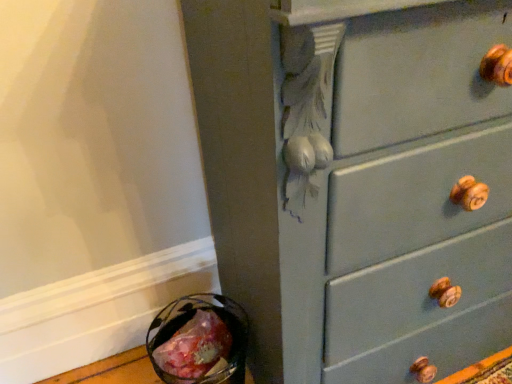
Question: Is matte gray dresser at center-right taller or shorter than translucent plastic bag at lower left?

Choices:
 (A) tall
 (B) short

Answer: (A)

Question: From a real-world perspective, is matte gray dresser at center-right physically located above or below translucent plastic bag at lower left?

Choices:
 (A) below
 (B) above

Answer: (B)

Question: Visually, is matte gray dresser at center-right positioned to the left or to the right of translucent plastic bag at lower left?

Choices:
 (A) right
 (B) left

Answer: (A)

Question: Based on their sizes in the image, would you say translucent plastic bag at lower left is bigger or smaller than matte gray dresser at center-right?

Choices:
 (A) big
 (B) small

Answer: (B)

Question: Is translucent plastic bag at lower left taller or shorter than matte gray dresser at center-right?

Choices:
 (A) tall
 (B) short

Answer: (B)

Question: Looking at their shapes, would you say translucent plastic bag at lower left is wider or thinner than matte gray dresser at center-right?

Choices:
 (A) thin
 (B) wide

Answer: (A)

Question: Do you think translucent plastic bag at lower left is within matte gray dresser at center-right, or outside of it?

Choices:
 (A) inside
 (B) outside

Answer: (B)